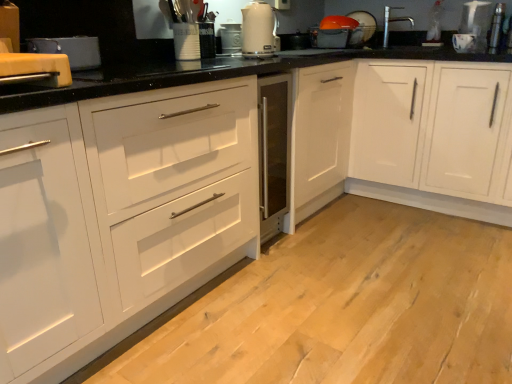
Identify the location of vacant point to the left of metallic silver toaster at upper right, which appears as the first appliance when viewed from the right. Image resolution: width=512 pixels, height=384 pixels. (471, 42).